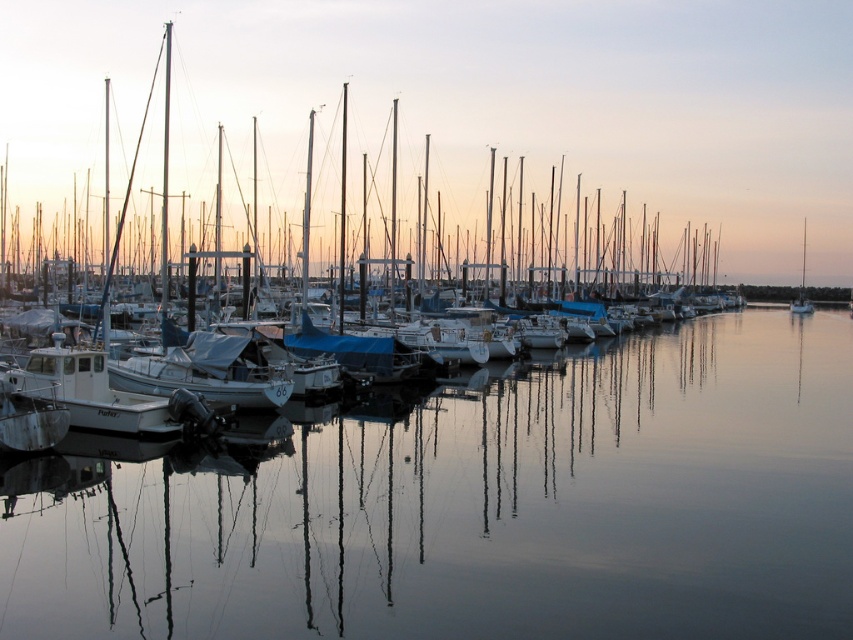
Does clear water at center come in front of white sailboat at right?

Yes, it is.

Does clear water at center appear over white sailboat at right?

Actually, clear water at center is below white sailboat at right.

Is point (741, 532) more distant than point (808, 308)?

No, (741, 532) is closer to viewer.

In order to click on clear water at center in this screenshot , I will do `click(480, 506)`.

Does white matte boat at left have a lesser height compared to white sailboat at right?

No.

Who is shorter, white matte boat at left or white sailboat at right?

white sailboat at right is shorter.

Is point (537, 164) less distant than point (796, 312)?

No, (537, 164) is behind (796, 312).

Where is `white matte boat at left`? white matte boat at left is located at coordinates (454, 125).

Can you confirm if clear water at center is taller than white matte boat at left?

In fact, clear water at center may be shorter than white matte boat at left.

Can you confirm if clear water at center is positioned to the left of white matte boat at left?

In fact, clear water at center is to the right of white matte boat at left.

Which is in front, point (401, 486) or point (697, 74)?

Positioned in front is point (401, 486).

Locate an element on the screen. The height and width of the screenshot is (640, 853). clear water at center is located at coordinates (480, 506).